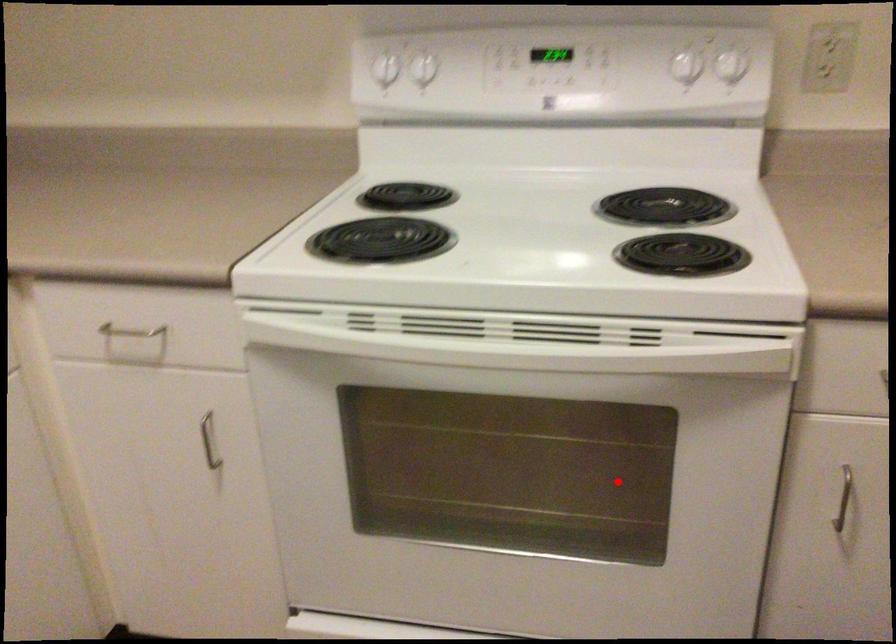
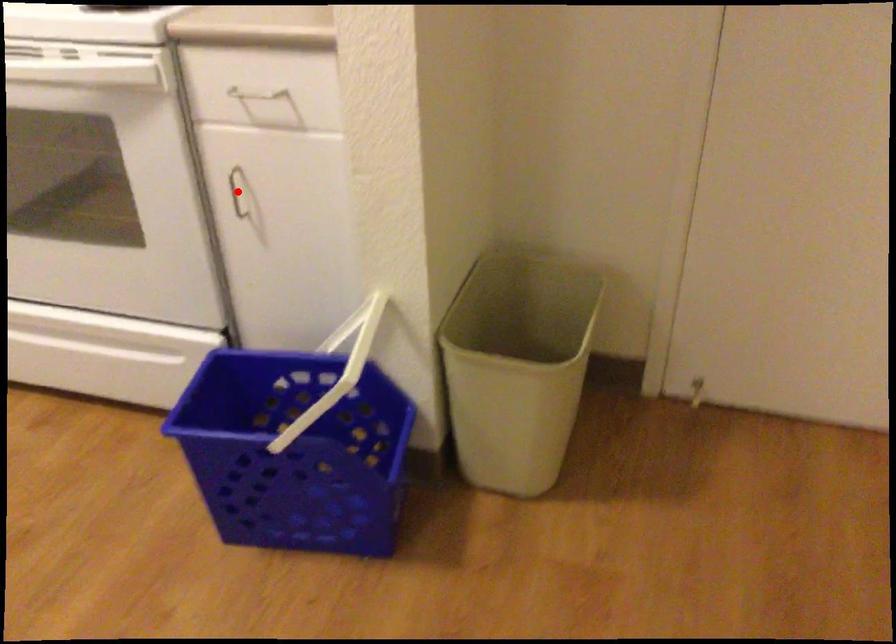
I am providing you with two images of the same scene from different viewpoints. A red point is marked on the first image and another point is marked on the second image. Is the red point in image1 aligned with the point shown in image2?

No